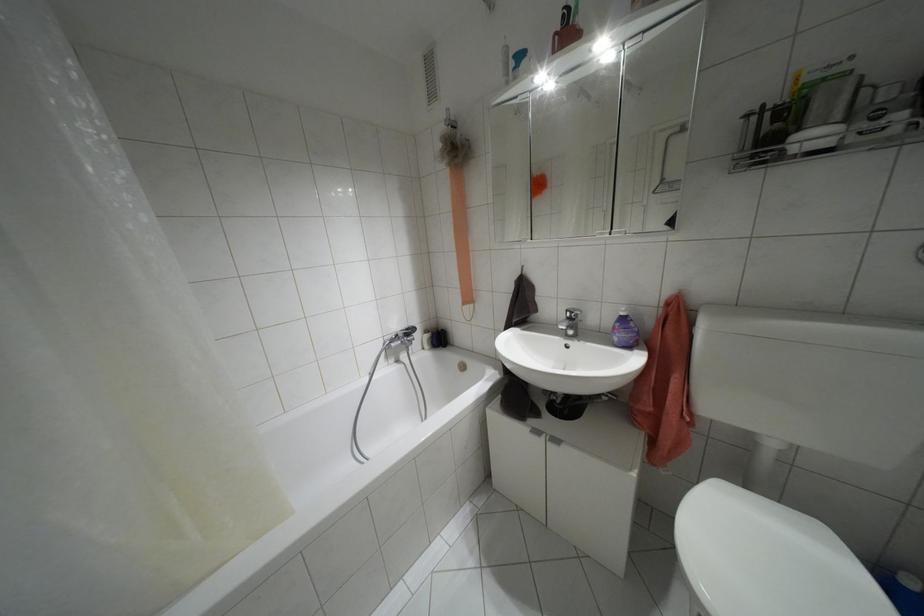
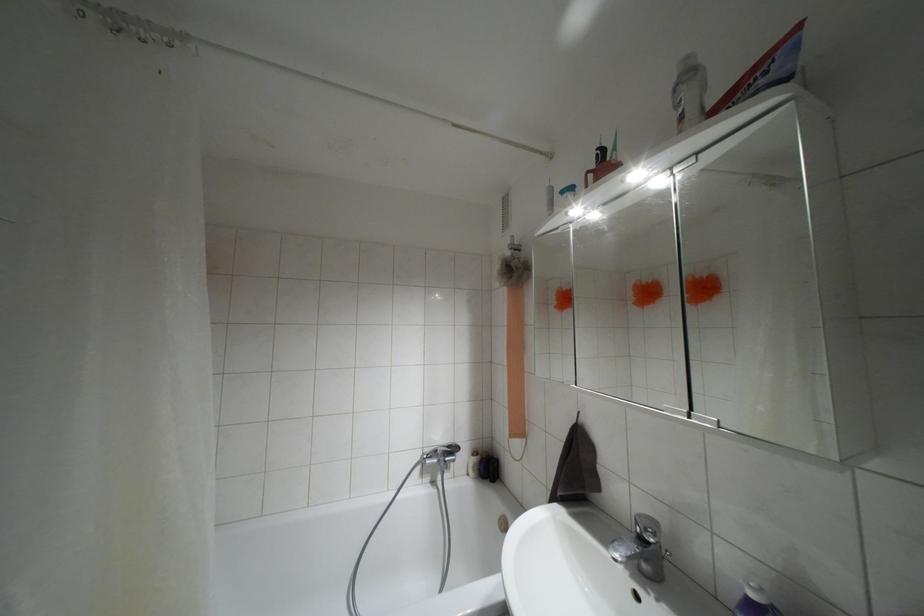
Find the pixel in the second image that matches [569,318] in the first image.

(641, 538)